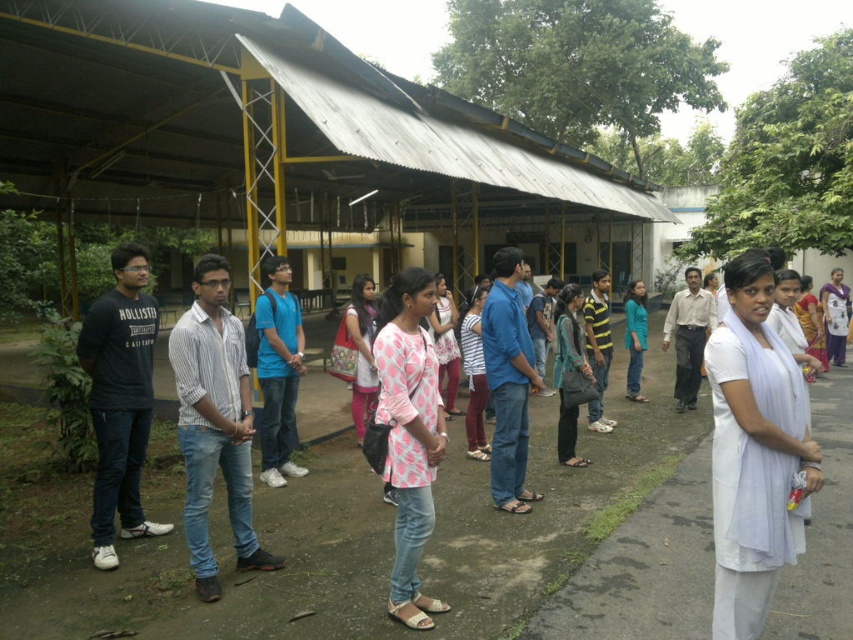
Question: Does white cotton kurta at center have a smaller size compared to light brown cotton shirt at center?

Choices:
 (A) yes
 (B) no

Answer: (B)

Question: From the image, what is the correct spatial relationship of light brown cotton shirt at center in relation to striped cotton shirt at center?

Choices:
 (A) below
 (B) above

Answer: (A)

Question: Which of the following is the farthest from the observer?

Choices:
 (A) pink printed dress at center
 (B) purple silk saree at right
 (C) dotted fabric dress at center

Answer: (B)

Question: Is white striped shirt at center behind blue jeans at center?

Choices:
 (A) yes
 (B) no

Answer: (B)

Question: Which point is closer to the camera?

Choices:
 (A) (602, 381)
 (B) (236, 376)
 (C) (637, 285)

Answer: (B)

Question: Which of the following is the closest to the observer?

Choices:
 (A) (511, 332)
 (B) (561, 410)
 (C) (738, 368)
 (D) (422, 609)

Answer: (C)